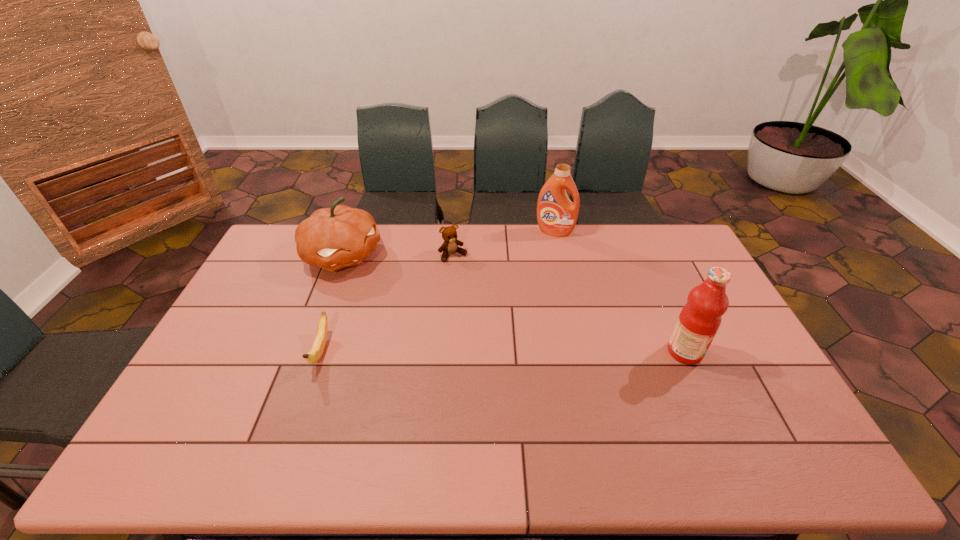
Find the location of `free space between the third object from right to left and the rightmost object`. free space between the third object from right to left and the rightmost object is located at coordinates (569, 303).

At what (x,y) coordinates should I click in order to perform the action: click on free space between the second shortest object and the fruit juice. Please return your answer as a coordinate pair (x, y). The width and height of the screenshot is (960, 540). Looking at the image, I should click on (569, 303).

This screenshot has width=960, height=540. Identify the location of free space between the second object from right to left and the rightmost object. (620, 292).

The image size is (960, 540). I want to click on vacant space that's between the shortest object and the second shortest object, so click(x=387, y=303).

At what (x,y) coordinates should I click in order to perform the action: click on unoccupied area between the third shortest object and the teddy bear. Please return your answer as a coordinate pair (x, y). Image resolution: width=960 pixels, height=540 pixels. Looking at the image, I should click on (397, 255).

Choose which object is the fourth nearest neighbor to the teddy bear. Please provide its 2D coordinates. Your answer should be formatted as a tuple, i.e. [(x, y)], where the tuple contains the x and y coordinates of a point satisfying the conditions above.

[(699, 320)]

At what (x,y) coordinates should I click in order to perform the action: click on object that ranks as the third closest to the pumpkin. Please return your answer as a coordinate pair (x, y). The width and height of the screenshot is (960, 540). Looking at the image, I should click on (556, 215).

Find the location of `free location that satisfies the following two spatial constraints: 1. at the stem of the shortest object; 2. on the front label of the fruit juice`. free location that satisfies the following two spatial constraints: 1. at the stem of the shortest object; 2. on the front label of the fruit juice is located at coordinates (321, 352).

The height and width of the screenshot is (540, 960). I want to click on vacant region that satisfies the following two spatial constraints: 1. at the stem of the rightmost object; 2. on the front label of the banana, so click(321, 352).

Where is `free space in the image that satisfies the following two spatial constraints: 1. on the front side of the fruit juice; 2. on the front label of the second object from right to left`? free space in the image that satisfies the following two spatial constraints: 1. on the front side of the fruit juice; 2. on the front label of the second object from right to left is located at coordinates (581, 352).